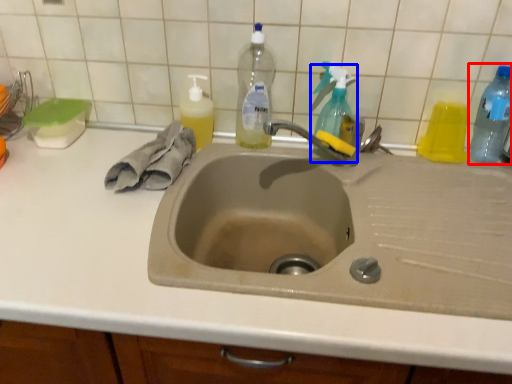
Question: Which of the following is the farthest to the observer, bottle (highlighted by a red box) or cleaning product (highlighted by a blue box)?

Choices:
 (A) bottle
 (B) cleaning product

Answer: (B)